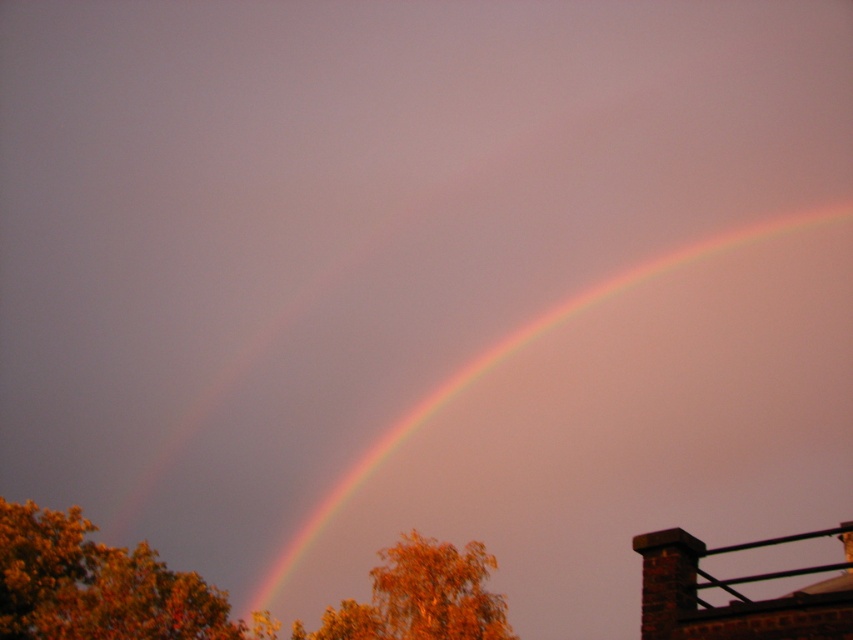
You are an artist painting the scene and want to place a small bird between the autumn leaves at lower left and the orange leafy tree at center. Which object should the bird be closer to?

The autumn leaves at lower left is positioned over the orange leafy tree at center, so the bird should be closer to the autumn leaves at lower left to maintain the spatial relationship.

You are an artist trying to paint the scene. You want to ensure the rainbow at upper center and autumn leaves at lower left are proportionally accurate. Which object should you make wider in your painting?

The rainbow at upper center should be made wider in the painting since its width is larger than the autumn leaves at lower left according to the description.

You are an artist planning to paint the scene. You want to ensure the rainbow at upper center and the orange leafy tree at center are proportionally accurate. Which object should you make wider in your painting?

The rainbow at upper center should be made wider in the painting since its width is larger than the orange leafy tree at center according to the description.